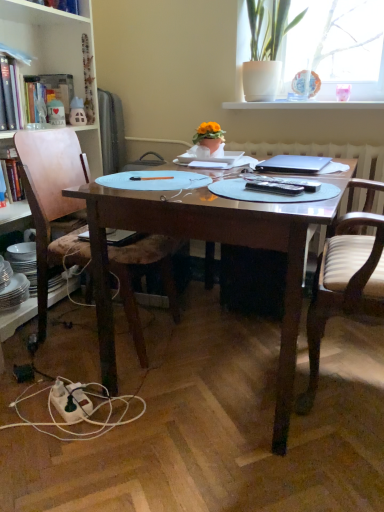
You are a GUI agent. You are given a task and a screenshot of the screen. Output one action in this format:
    pyautogui.click(x=<x>, y=<y>)
    Task: Click on the vacant area on the back side of white plastic power outlet at lower left
    
    Given the screenshot: What is the action you would take?
    pyautogui.click(x=79, y=371)